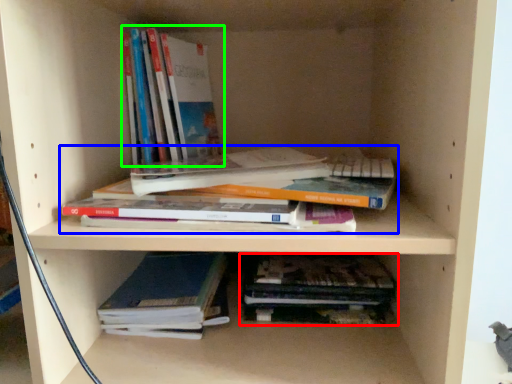
Question: Which object is the farthest from book (highlighted by a red box)? Choose among these: book (highlighted by a blue box) or book (highlighted by a green box).

Choices:
 (A) book
 (B) book

Answer: (B)